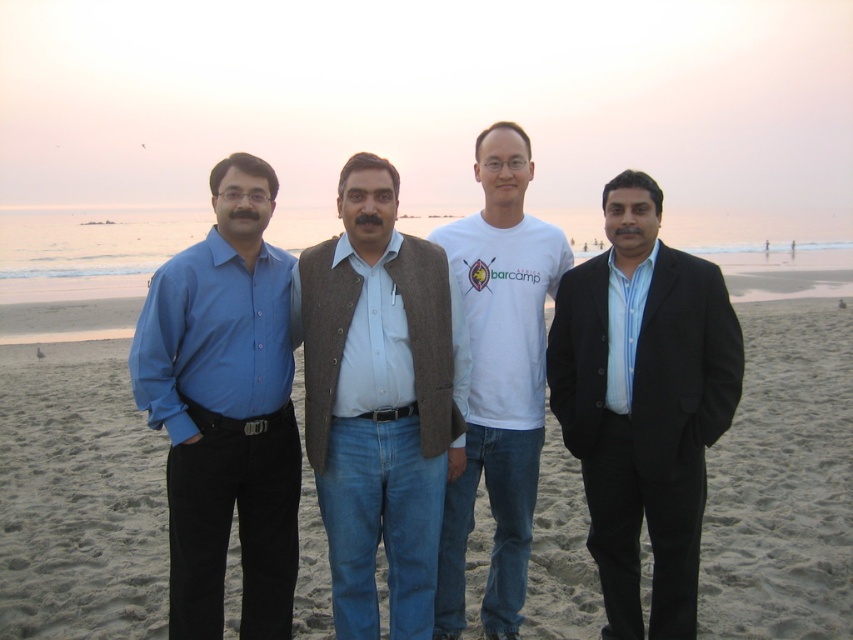
You are standing at the origin point of the coordinate system. You see two points in the image, point (369, 243) and point (489, 618). Which point is closer to you?

Point (369, 243) is in front of point (489, 618), so it is closer to you.